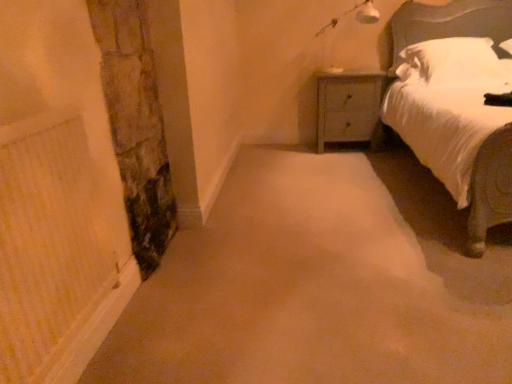
This screenshot has height=384, width=512. I want to click on white satin bed at upper right, so click(457, 104).

This screenshot has height=384, width=512. What do you see at coordinates (136, 127) in the screenshot?
I see `stone textured pillar at left` at bounding box center [136, 127].

Locate an element on the screen. The height and width of the screenshot is (384, 512). white soft pillow at upper right is located at coordinates (451, 62).

Where is `wooden nightstand at upper right`? wooden nightstand at upper right is located at coordinates (347, 106).

This screenshot has width=512, height=384. I want to click on white plastic lamp at upper right, so click(355, 15).

I want to click on white satin bed at upper right, so click(457, 104).

From the image's perspective, which is below, white satin bed at upper right or wooden nightstand at upper right?

white satin bed at upper right is shown below in the image.

Is white satin bed at upper right thinner than wooden nightstand at upper right?

No, white satin bed at upper right is not thinner than wooden nightstand at upper right.

From a real-world perspective, who is located higher, white satin bed at upper right or wooden nightstand at upper right?

white satin bed at upper right.

Is white soft pillow at upper right outside of white satin bed at upper right?

No, white soft pillow at upper right is not entirely external to white satin bed at upper right.

Which is more to the left, white soft pillow at upper right or white satin bed at upper right?

white soft pillow at upper right.

Between point (415, 70) and point (469, 170), which one is positioned in front?

The point (469, 170) is closer.

Could you tell me if white soft pillow at upper right is facing white satin bed at upper right?

Yes, white soft pillow at upper right is oriented towards white satin bed at upper right.

Based on the photo, looking at their sizes, would you say wooden nightstand at upper right is wider or thinner than white soft pillow at upper right?

Clearly, wooden nightstand at upper right has less width compared to white soft pillow at upper right.

From the image's perspective, is wooden nightstand at upper right on white soft pillow at upper right?

No.

Is wooden nightstand at upper right facing away from white soft pillow at upper right?

No, wooden nightstand at upper right's orientation is not away from white soft pillow at upper right.

Could white soft pillow at upper right be considered to be inside wooden nightstand at upper right?

No, white soft pillow at upper right is located outside of wooden nightstand at upper right.

Is wooden nightstand at upper right positioned behind stone textured pillar at left?

Yes, the depth of wooden nightstand at upper right is greater than that of stone textured pillar at left.

How much distance is there between wooden nightstand at upper right and stone textured pillar at left?

The distance of wooden nightstand at upper right from stone textured pillar at left is 1.90 meters.

At what (x,y) coordinates should I click in order to perform the action: click on nightstand that is above the stone textured pillar at left (from the image's perspective). Please return your answer as a coordinate pair (x, y). Looking at the image, I should click on (347, 106).

Does wooden nightstand at upper right have a lesser width compared to stone textured pillar at left?

No.

Between white plastic lamp at upper right and white satin bed at upper right, which one is positioned behind?

Positioned behind is white plastic lamp at upper right.

Is white plastic lamp at upper right facing towards white satin bed at upper right?

No, white plastic lamp at upper right does not turn towards white satin bed at upper right.

Considering the sizes of objects white plastic lamp at upper right and white satin bed at upper right in the image provided, who is thinner, white plastic lamp at upper right or white satin bed at upper right?

With smaller width is white plastic lamp at upper right.

Looking at this image, is white plastic lamp at upper right with white satin bed at upper right?

No, white plastic lamp at upper right is not beside white satin bed at upper right.

Could you tell me if stone textured pillar at left is turned towards white soft pillow at upper right?

No, stone textured pillar at left does not turn towards white soft pillow at upper right.

Is point (108, 6) farther from camera compared to point (479, 40)?

No, (108, 6) is closer to viewer.

Is stone textured pillar at left thinner than white soft pillow at upper right?

Yes, stone textured pillar at left is thinner than white soft pillow at upper right.

Is stone textured pillar at left situated inside white soft pillow at upper right or outside?

stone textured pillar at left is spatially situated outside white soft pillow at upper right.

Is white plastic lamp at upper right in contact with stone textured pillar at left?

There is a gap between white plastic lamp at upper right and stone textured pillar at left.

Can you confirm if white plastic lamp at upper right is taller than stone textured pillar at left?

In fact, white plastic lamp at upper right may be shorter than stone textured pillar at left.

Considering the points (367, 23) and (163, 127), which point is behind, point (367, 23) or point (163, 127)?

The point (367, 23) is more distant.

Which is behind, white plastic lamp at upper right or stone textured pillar at left?

white plastic lamp at upper right is more distant.

You are a GUI agent. You are given a task and a screenshot of the screen. Output one action in this format:
    pyautogui.click(x=<x>, y=<y>)
    Task: Click on the bed lying below the wooden nightstand at upper right (from the image's perspective)
    
    Given the screenshot: What is the action you would take?
    pyautogui.click(x=457, y=104)

You are a GUI agent. You are given a task and a screenshot of the screen. Output one action in this format:
    pyautogui.click(x=<x>, y=<y>)
    Task: Click on the pillow located above the white satin bed at upper right (from a real-world perspective)
    
    Given the screenshot: What is the action you would take?
    pyautogui.click(x=451, y=62)

From the picture: Which object lies further to the anchor point white soft pillow at upper right, white satin bed at upper right or wooden nightstand at upper right?

wooden nightstand at upper right.

Looking at this image, based on their spatial positions, is wooden nightstand at upper right or white satin bed at upper right closer to stone textured pillar at left?

The object closer to stone textured pillar at left is white satin bed at upper right.

From the image, which object appears to be farther from white satin bed at upper right, white plastic lamp at upper right or wooden nightstand at upper right?

Among the two, white plastic lamp at upper right is located further to white satin bed at upper right.

When comparing their distances from white satin bed at upper right, does white soft pillow at upper right or white plastic lamp at upper right seem closer?

white soft pillow at upper right is positioned closer to the anchor white satin bed at upper right.

Which object lies further to the anchor point white plastic lamp at upper right, white satin bed at upper right or stone textured pillar at left?

stone textured pillar at left is further to white plastic lamp at upper right.

Consider the image. Looking at the image, which one is located closer to stone textured pillar at left, white satin bed at upper right or wooden nightstand at upper right?

Among the two, white satin bed at upper right is located nearer to stone textured pillar at left.

Based on their spatial positions, is white soft pillow at upper right or white satin bed at upper right closer to wooden nightstand at upper right?

white soft pillow at upper right is positioned closer to the anchor wooden nightstand at upper right.

Looking at the image, which one is located closer to white plastic lamp at upper right, white satin bed at upper right or wooden nightstand at upper right?

wooden nightstand at upper right is positioned closer to the anchor white plastic lamp at upper right.

Locate an element on the screen. The width and height of the screenshot is (512, 384). nightstand between stone textured pillar at left and white soft pillow at upper right is located at coordinates (347, 106).

Where is `pillow situated between stone textured pillar at left and white satin bed at upper right from left to right`? This screenshot has height=384, width=512. pillow situated between stone textured pillar at left and white satin bed at upper right from left to right is located at coordinates (451, 62).

Identify the location of pillow between white satin bed at upper right and wooden nightstand at upper right in the front-back direction. (451, 62).

Find the location of a particular element. The image size is (512, 384). nightstand between white plastic lamp at upper right and white soft pillow at upper right from left to right is located at coordinates (347, 106).